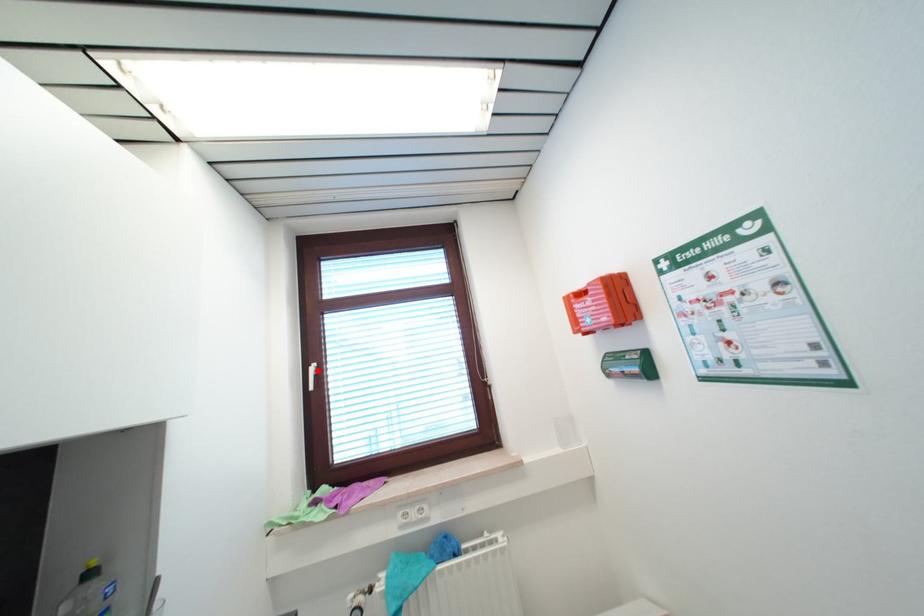
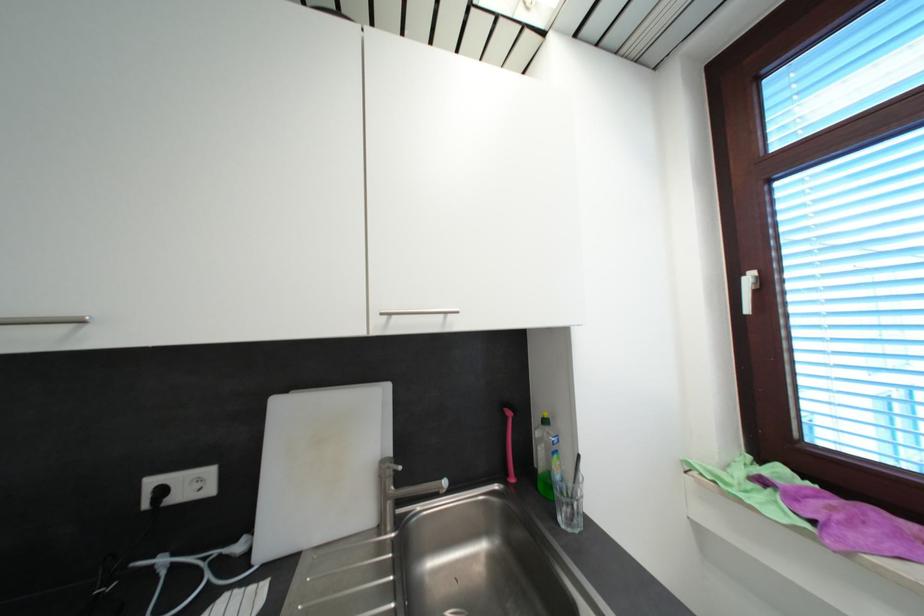
Find the pixel in the second image that matches the highlighted location in the first image.

(754, 281)